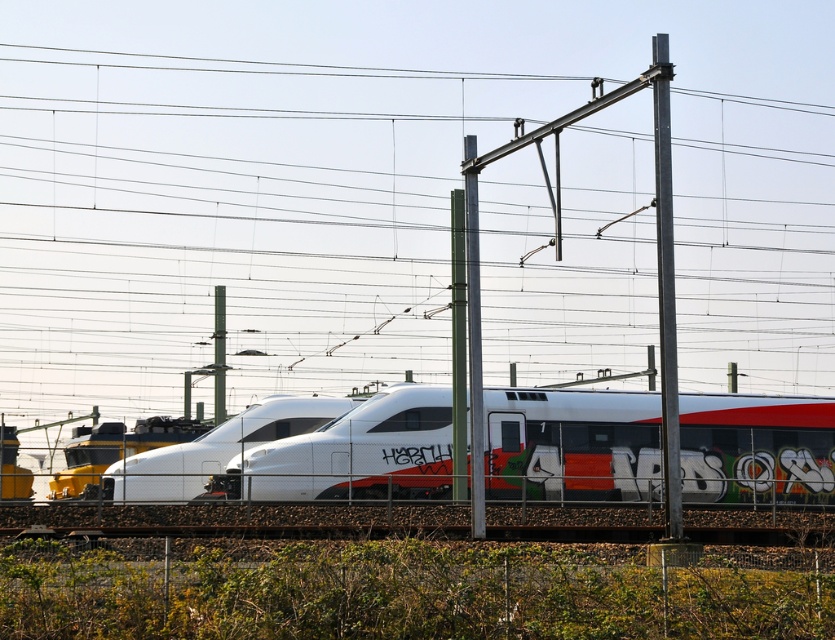
You are standing behind a chain link fence and see the white matte train at center approaching you. If the train is moving at 60 mph, how many seconds will it take for the train to reach the fence?

The white matte train at center is 129.47 feet away from the camera. Converting 60 mph to feet per second gives approximately 88 feet per second. Dividing the distance by speed, 129.47 divided by 88 equals roughly 1.47 seconds. Therefore, it will take about 1.47 seconds for the train to reach the fence.

In the scene shown: You are standing next to the chain link fence in the scene. You see the point marked by coordinates point (665, 288). What object does this point correspond to?

The point (665, 288) corresponds to the metallic gray pole at center right.

You are standing in front of the train and want to touch both points on the train. Which point should you reach first, point (606, 419) or point (454, 440)?

Point (606, 419) is closer to you, so you should reach it first.